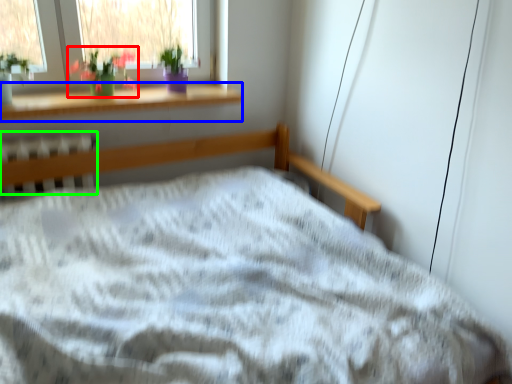
Question: Estimate the real-world distances between objects in this image. Which object is closer to floral arrangement (highlighted by a red box), window sill (highlighted by a blue box) or radiator (highlighted by a green box)?

Choices:
 (A) window sill
 (B) radiator

Answer: (A)